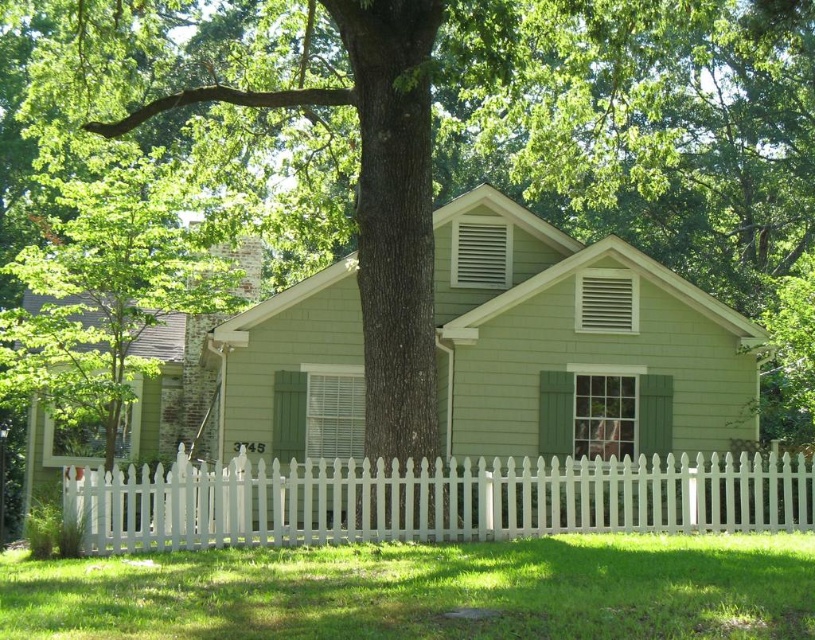
Question: Is green painted wood shutter at center positioned in front of green matte shutter at upper right?

Choices:
 (A) yes
 (B) no

Answer: (B)

Question: Among these points, which one is farthest from the camera?

Choices:
 (A) (584, 282)
 (B) (275, 554)
 (C) (346, 422)

Answer: (C)

Question: Which object is farther from the camera taking this photo?

Choices:
 (A) white picket fence at lower center
 (B) white matte vent at upper center
 (C) green grass at lower center
 (D) green painted wood shutter at center

Answer: (B)

Question: Which object appears closest to the camera in this image?

Choices:
 (A) white picket fence at lower center
 (B) green painted wood shutter at center
 (C) green matte shutter at upper right

Answer: (A)

Question: Is green grass at lower center below green matte shutter at upper right?

Choices:
 (A) no
 (B) yes

Answer: (B)

Question: Does white picket fence at lower center have a greater width compared to green matte shutter at upper right?

Choices:
 (A) yes
 (B) no

Answer: (A)